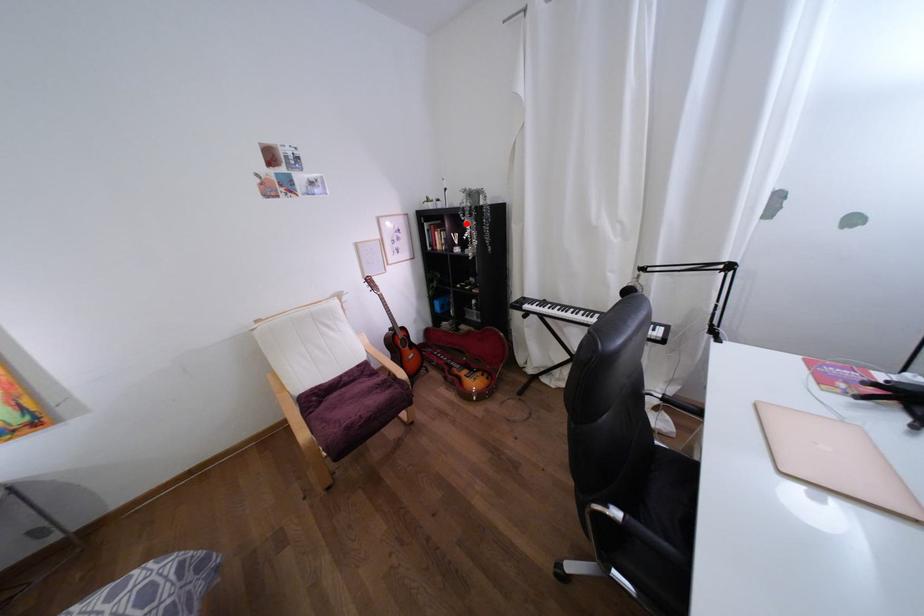
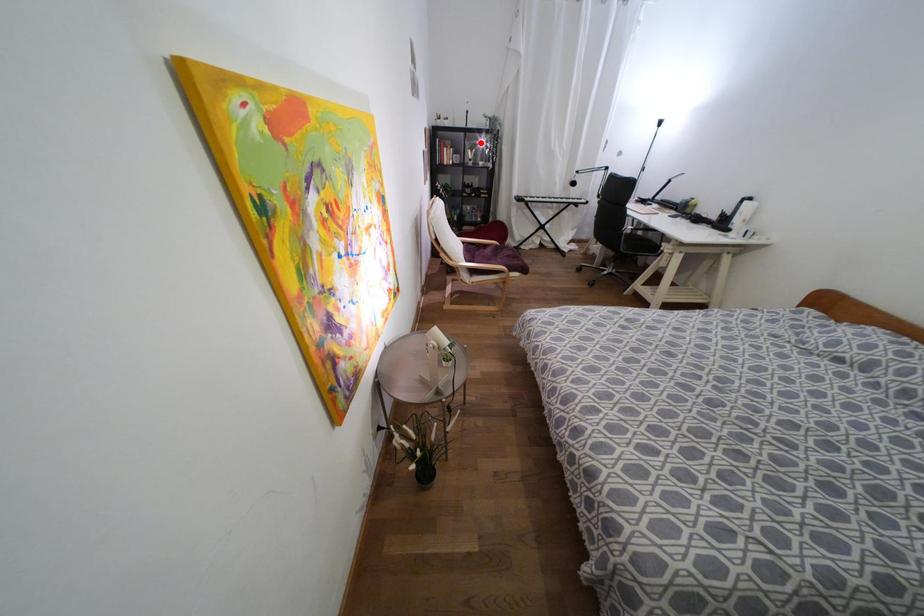
I am providing you with two images of the same scene from different viewpoints. A red point is marked on the first image and another point is marked on the second image. Does the point marked in image1 correspond to the same location as the one in image2?

Yes